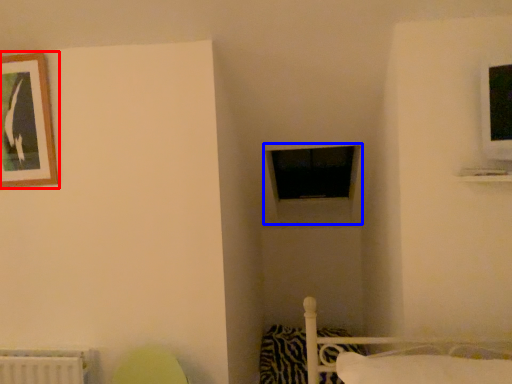
Question: Which object is further to the camera taking this photo, picture frame (highlighted by a red box) or window frame (highlighted by a blue box)?

Choices:
 (A) picture frame
 (B) window frame

Answer: (B)